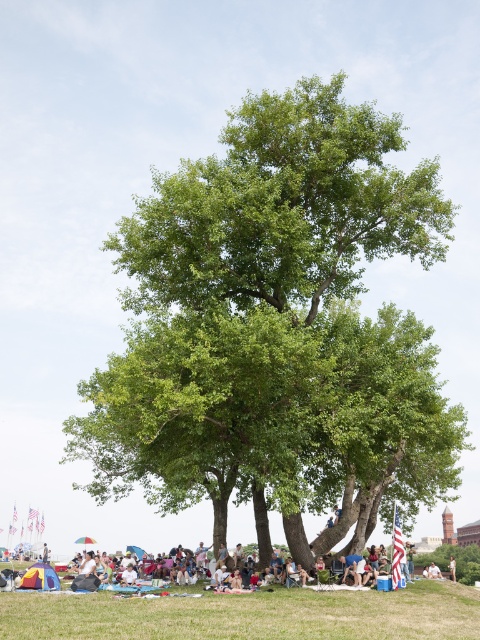
You are planning to set up a picnic blanket in the green grassy field at lower center. Considering the position of the green leafy tree at center, will it provide shade over your blanket?

The green leafy tree at center is above the green grassy field at lower center, so yes, it will provide shade over the blanket.

You are planning to place the light brown wooden stick at center on the green grassy field at lower center. Based on their widths, will the stick fit entirely on the field without overhanging?

The green grassy field at lower center is wider than the light brown wooden stick at center, so the stick will fit entirely on the field without overhanging.

You are planning to set up a picnic blanket for a family gathering. You have two options for placement under the green leafy tree at center and on the green grassy field at lower center. Considering the scene, where should you place the blanket to ensure it stays in the shade?

The green leafy tree at center is positioned on the right side of green grassy field at lower center, so placing the blanket under the tree would provide shade from the tree canopy.